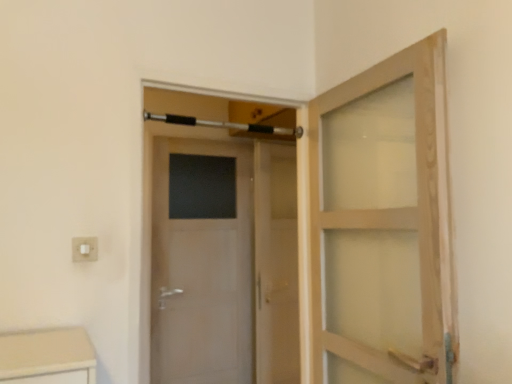
Question: Can you confirm if white plastic electric outlet at lower left is smaller than silver metallic towel bar at upper center?

Choices:
 (A) yes
 (B) no

Answer: (A)

Question: Is white plastic electric outlet at lower left facing away from silver metallic towel bar at upper center?

Choices:
 (A) yes
 (B) no

Answer: (B)

Question: From a real-world perspective, is white plastic electric outlet at lower left under silver metallic towel bar at upper center?

Choices:
 (A) no
 (B) yes

Answer: (B)

Question: From the image's perspective, is white plastic electric outlet at lower left above silver metallic towel bar at upper center?

Choices:
 (A) no
 (B) yes

Answer: (A)

Question: Is white plastic electric outlet at lower left surrounding silver metallic towel bar at upper center?

Choices:
 (A) no
 (B) yes

Answer: (A)

Question: Are white plastic electric outlet at lower left and silver metallic towel bar at upper center far apart?

Choices:
 (A) yes
 (B) no

Answer: (A)

Question: Does clear glass screen door at center appear on the left side of white glossy door at center?

Choices:
 (A) no
 (B) yes

Answer: (A)

Question: Can you confirm if clear glass screen door at center is shorter than white glossy door at center?

Choices:
 (A) no
 (B) yes

Answer: (A)

Question: Is clear glass screen door at center placed right next to white glossy door at center?

Choices:
 (A) yes
 (B) no

Answer: (B)

Question: Is the position of clear glass screen door at center less distant than that of white glossy door at center?

Choices:
 (A) yes
 (B) no

Answer: (B)

Question: Can you confirm if clear glass screen door at center is wider than white glossy door at center?

Choices:
 (A) no
 (B) yes

Answer: (B)

Question: Does clear glass screen door at center have a lesser width compared to white glossy door at center?

Choices:
 (A) no
 (B) yes

Answer: (A)

Question: From a real-world perspective, does white plastic electric outlet at lower left sit lower than clear glass screen door at center?

Choices:
 (A) yes
 (B) no

Answer: (B)